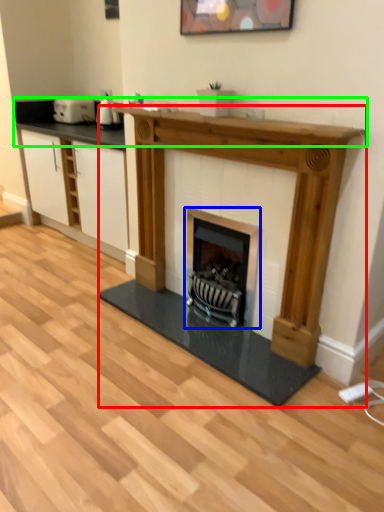
Question: Which object is the closest to the fireplace (highlighted by a red box)? Choose among these: wood burning stove (highlighted by a blue box) or counter top (highlighted by a green box).

Choices:
 (A) wood burning stove
 (B) counter top

Answer: (A)